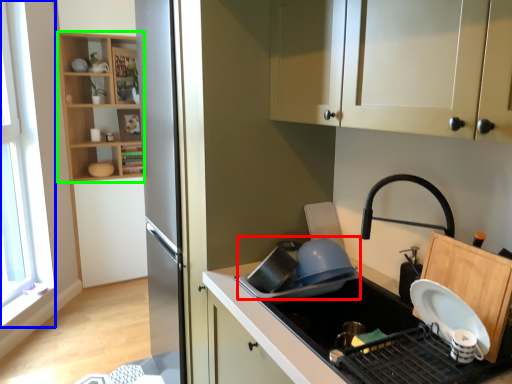
Question: Which object is the farthest from appliance (highlighted by a red box)? Choose among these: window (highlighted by a blue box) or shelf (highlighted by a green box).

Choices:
 (A) window
 (B) shelf

Answer: (B)